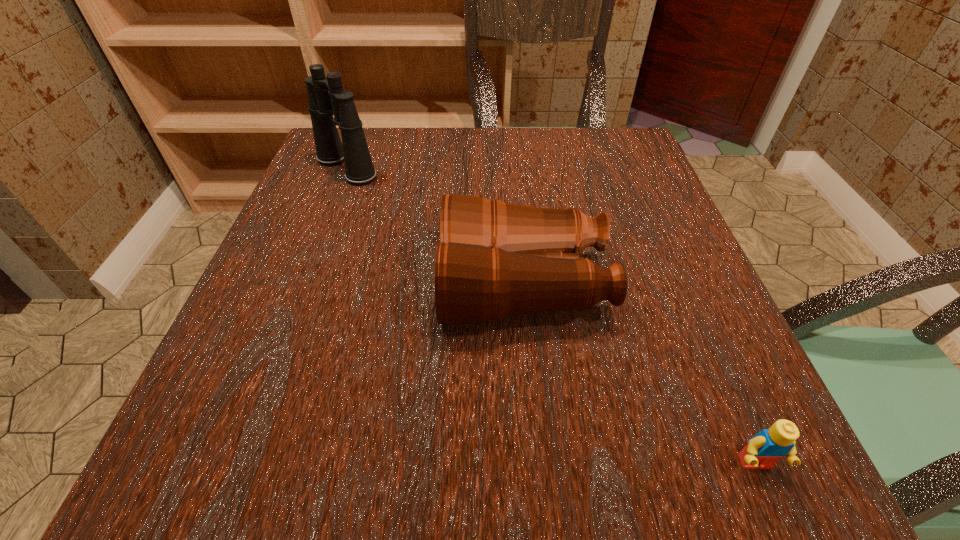
Find the location of a particular element. This screenshot has width=960, height=540. free point between the shorter binoculars and the taller binoculars is located at coordinates (435, 226).

This screenshot has width=960, height=540. Find the location of `free spot between the right binoculars and the leftmost object`. free spot between the right binoculars and the leftmost object is located at coordinates (x=435, y=226).

Choose which object is the second nearest neighbor to the nearest object. Please provide its 2D coordinates. Your answer should be formatted as a tuple, i.e. [(x, y)], where the tuple contains the x and y coordinates of a point satisfying the conditions above.

[(326, 96)]

Point out which object is positioned as the second nearest to the shortest object. Please provide its 2D coordinates. Your answer should be formatted as a tuple, i.e. [(x, y)], where the tuple contains the x and y coordinates of a point satisfying the conditions above.

[(326, 96)]